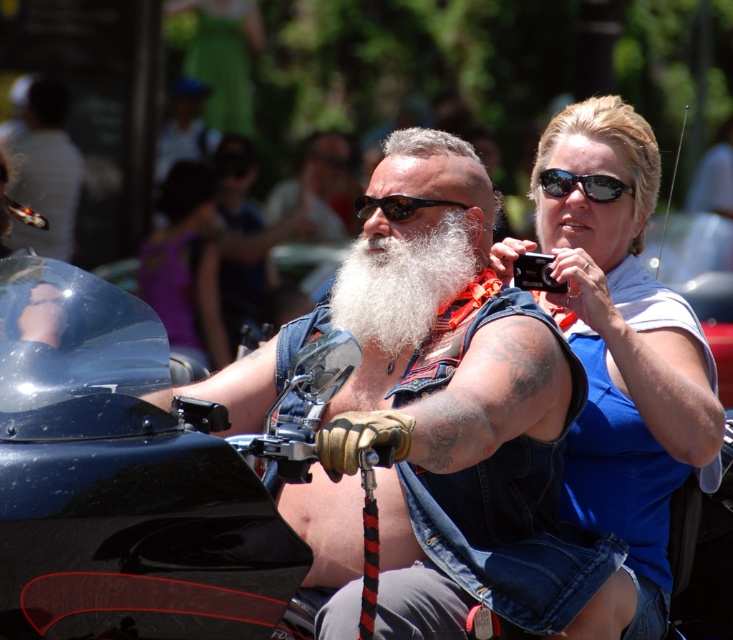
Between black plastic sunglasses at upper right and sunglasses at center, which one is positioned lower?

sunglasses at center

Which of these two, black plastic sunglasses at upper right or sunglasses at center, stands shorter?

Standing shorter between the two is sunglasses at center.

Where is `black plastic sunglasses at upper right`? black plastic sunglasses at upper right is located at coordinates (581, 184).

Which of these two, denim vest at center or black plastic sunglasses at upper right, stands shorter?

With less height is black plastic sunglasses at upper right.

In the scene shown: Which is more to the right, denim vest at center or black plastic sunglasses at upper right?

black plastic sunglasses at upper right

Which is in front, point (416, 404) or point (608, 182)?

Point (416, 404) is in front.

I want to click on denim vest at center, so click(x=438, y=413).

Is point (361, 275) behind point (575, 179)?

No, it is not.

This screenshot has width=733, height=640. Describe the element at coordinates (402, 282) in the screenshot. I see `white fluffy beard at center` at that location.

Locate an element on the screen. The height and width of the screenshot is (640, 733). white fluffy beard at center is located at coordinates (402, 282).

Find the location of a particular element. The height and width of the screenshot is (640, 733). white fluffy beard at center is located at coordinates (402, 282).